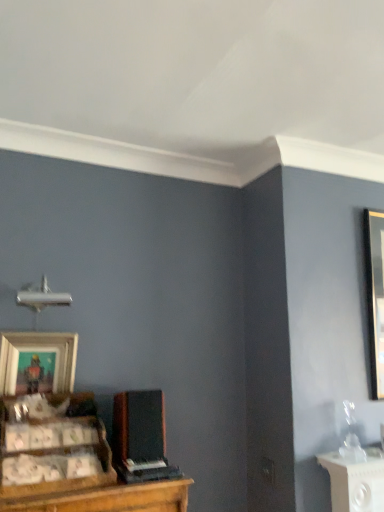
Question: Considering the relative sizes of wooden picture frame at lower left and wooden cabinet at lower left in the image provided, is wooden picture frame at lower left thinner than wooden cabinet at lower left?

Choices:
 (A) no
 (B) yes

Answer: (B)

Question: Is wooden picture frame at lower left far from wooden cabinet at lower left?

Choices:
 (A) yes
 (B) no

Answer: (B)

Question: Is wooden picture frame at lower left to the right of wooden cabinet at lower left from the viewer's perspective?

Choices:
 (A) yes
 (B) no

Answer: (B)

Question: From the image's perspective, is wooden picture frame at lower left above wooden cabinet at lower left?

Choices:
 (A) yes
 (B) no

Answer: (A)

Question: Can you confirm if wooden picture frame at lower left is wider than wooden cabinet at lower left?

Choices:
 (A) no
 (B) yes

Answer: (A)

Question: Considering the relative sizes of wooden picture frame at lower left and wooden cabinet at lower left in the image provided, is wooden picture frame at lower left taller than wooden cabinet at lower left?

Choices:
 (A) no
 (B) yes

Answer: (B)

Question: Can we say wooden cabinet at lower left lies outside black matte speaker at center?

Choices:
 (A) no
 (B) yes

Answer: (B)

Question: Does wooden cabinet at lower left have a lesser height compared to black matte speaker at center?

Choices:
 (A) yes
 (B) no

Answer: (B)

Question: Is wooden cabinet at lower left closer to the viewer compared to black matte speaker at center?

Choices:
 (A) no
 (B) yes

Answer: (B)

Question: Considering the relative positions of wooden cabinet at lower left and black matte speaker at center in the image provided, is wooden cabinet at lower left to the left of black matte speaker at center from the viewer's perspective?

Choices:
 (A) no
 (B) yes

Answer: (B)

Question: Could you tell me if wooden cabinet at lower left is facing black matte speaker at center?

Choices:
 (A) no
 (B) yes

Answer: (A)

Question: Is wooden cabinet at lower left facing away from black matte speaker at center?

Choices:
 (A) no
 (B) yes

Answer: (A)

Question: Can you confirm if wooden cabinet at lower left is shorter than wooden picture frame at lower left?

Choices:
 (A) no
 (B) yes

Answer: (B)